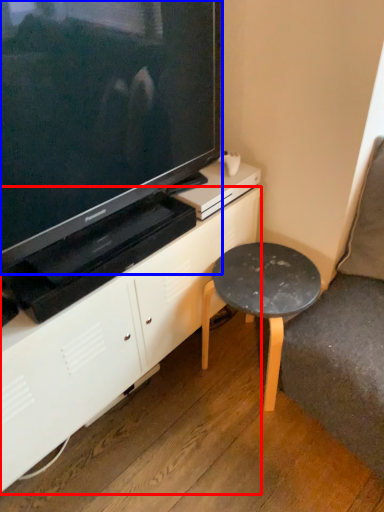
Question: Which of the following is the closest to the observer, cabinetry (highlighted by a red box) or television (highlighted by a blue box)?

Choices:
 (A) cabinetry
 (B) television

Answer: (B)